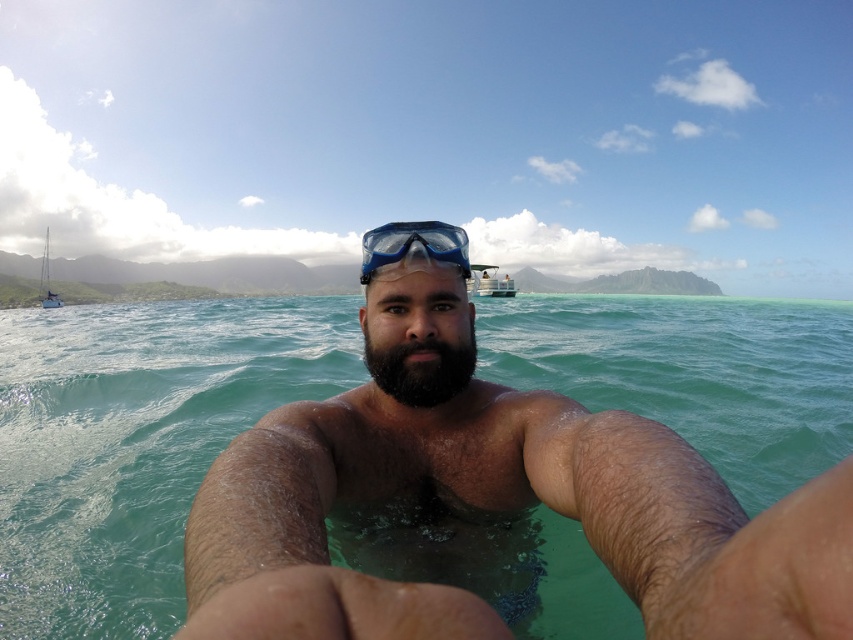
Based on the photo, which is more to the left, blue matte snorkel mask at center or white plastic sailboat at left?

From the viewer's perspective, white plastic sailboat at left appears more on the left side.

Which is in front, point (430, 246) or point (45, 292)?

Point (430, 246) is more forward.

You are a GUI agent. You are given a task and a screenshot of the screen. Output one action in this format:
    pyautogui.click(x=<x>, y=<y>)
    Task: Click on the blue matte snorkel mask at center
    
    Given the screenshot: What is the action you would take?
    pyautogui.click(x=412, y=243)

Does clear water at center appear over white plastic boat at upper center?

No, clear water at center is not above white plastic boat at upper center.

Between clear water at center and white plastic boat at upper center, which one has more height?

Standing taller between the two is white plastic boat at upper center.

Which is behind, point (109, 531) or point (515, 289)?

Positioned behind is point (515, 289).

Find the location of a particular element. The height and width of the screenshot is (640, 853). clear water at center is located at coordinates (134, 442).

Is dark brown fuzzy beard at center wider than white plastic sailboat at left?

In fact, dark brown fuzzy beard at center might be narrower than white plastic sailboat at left.

From the picture: Is the position of dark brown fuzzy beard at center less distant than that of white plastic sailboat at left?

Yes.

Image resolution: width=853 pixels, height=640 pixels. Describe the element at coordinates (421, 369) in the screenshot. I see `dark brown fuzzy beard at center` at that location.

This screenshot has height=640, width=853. Find the location of `dark brown fuzzy beard at center`. dark brown fuzzy beard at center is located at coordinates (421, 369).